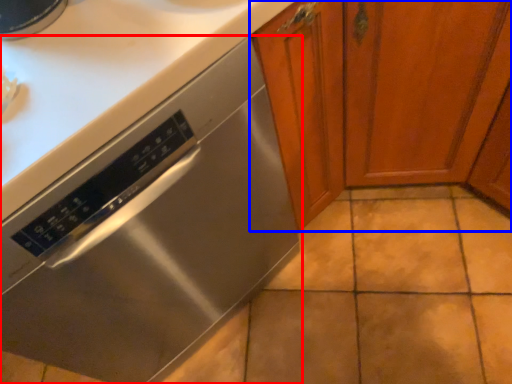
Question: Which of the following is the closest to the observer, home appliance (highlighted by a red box) or cabinetry (highlighted by a blue box)?

Choices:
 (A) home appliance
 (B) cabinetry

Answer: (B)